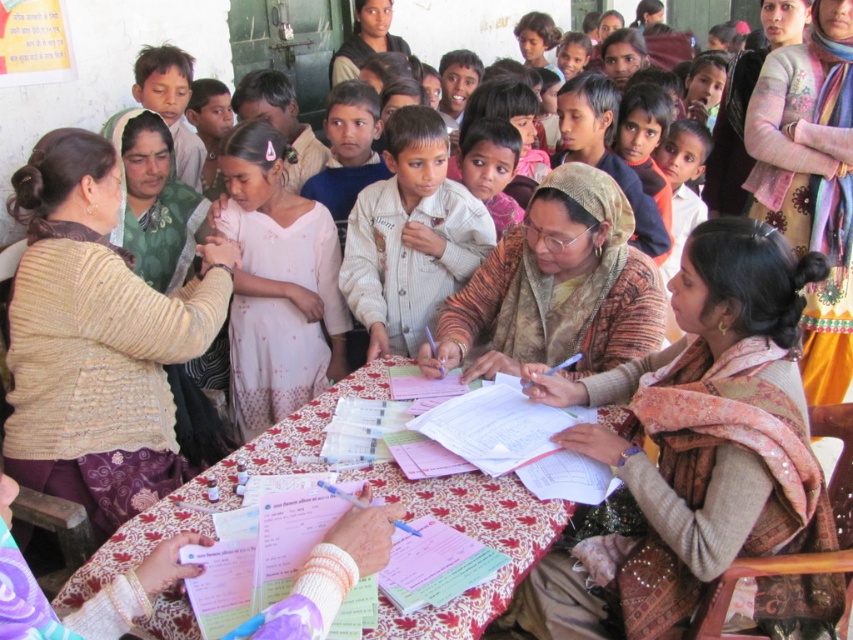
From the picture: You are a participant at the community event and need to reach both the point at coordinates point (846,268) and point (397,136) on the table. Which point should you approach first to ensure you can reach them without moving around the table?

You should approach point (397,136) first because it is closer to you than point (846,268), which is further away from you.

You are a photographer at this community event and want to capture a clear photo of the patterned fabric table at center and the pink fabric dress at center. Which object will appear larger in the photo?

The patterned fabric table at center will appear larger in the photo because it is closer to the viewer than the pink fabric dress at center.

You are a health worker at a community event. You need to hand a document to the person wearing the pink fabric dress at center. The document is on the patterned fabric table at center. Can you reach them without moving the table or the dress?

The patterned fabric table at center and pink fabric dress at center are 34.87 inches apart, so yes, you can reach them without moving either object since the distance is manageable for handing over the document.